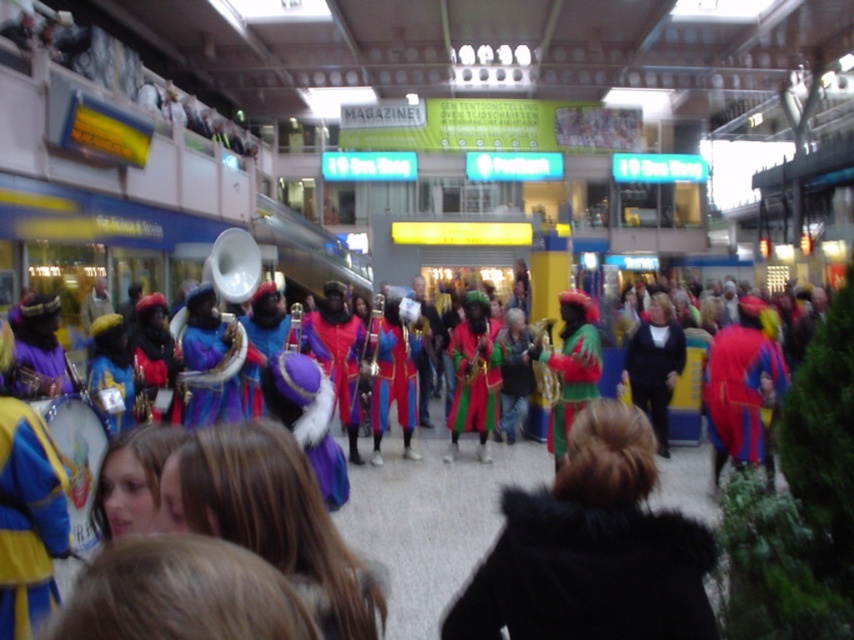
Question: Is multicolored costume at center below velvet purple robe at center?

Choices:
 (A) yes
 (B) no

Answer: (A)

Question: Which object appears closest to the camera in this image?

Choices:
 (A) velvet red coat at center
 (B) velvet purple robe at center

Answer: (A)

Question: Which point is farther to the camera?

Choices:
 (A) shiny red fabric at right
 (B) shiny green fabric at center
 (C) green velvet costume at center
 (D) velvet blue robe at center

Answer: (B)

Question: Observing the image, what is the correct spatial positioning of blue velvet hat at lower left in reference to shiny green fabric at center?

Choices:
 (A) above
 (B) below

Answer: (A)

Question: Can you confirm if multicolored costume at center is positioned below shiny green fabric at center?

Choices:
 (A) no
 (B) yes

Answer: (B)

Question: Which point appears farthest from the camera in this image?

Choices:
 (A) (674, 349)
 (B) (455, 378)

Answer: (B)